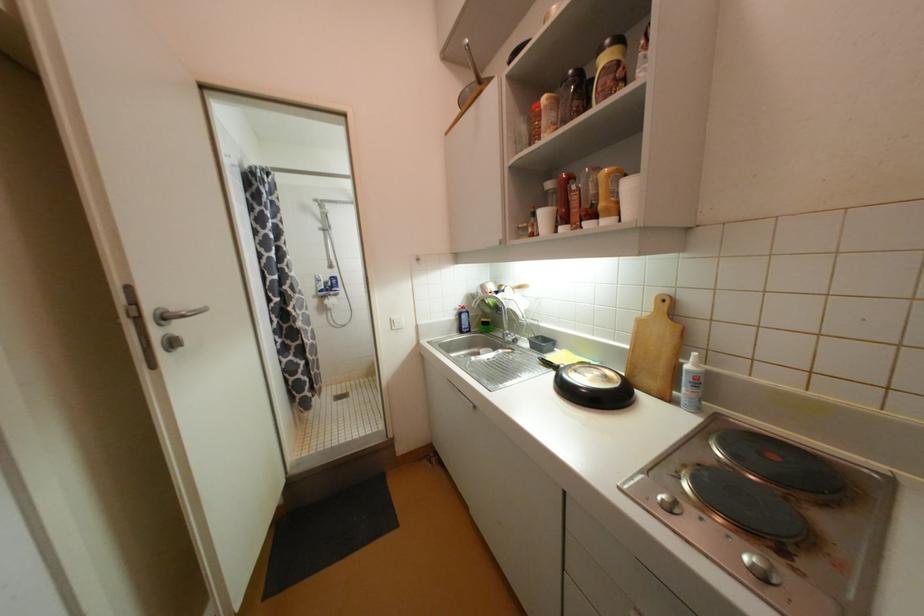
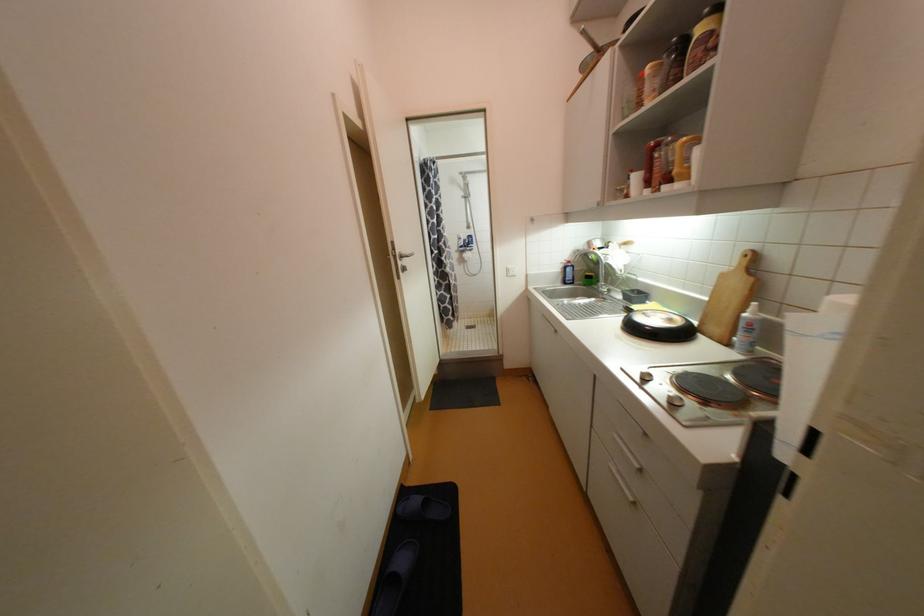
In the second image, find the point that corresponds to (600,217) in the first image.

(675, 180)